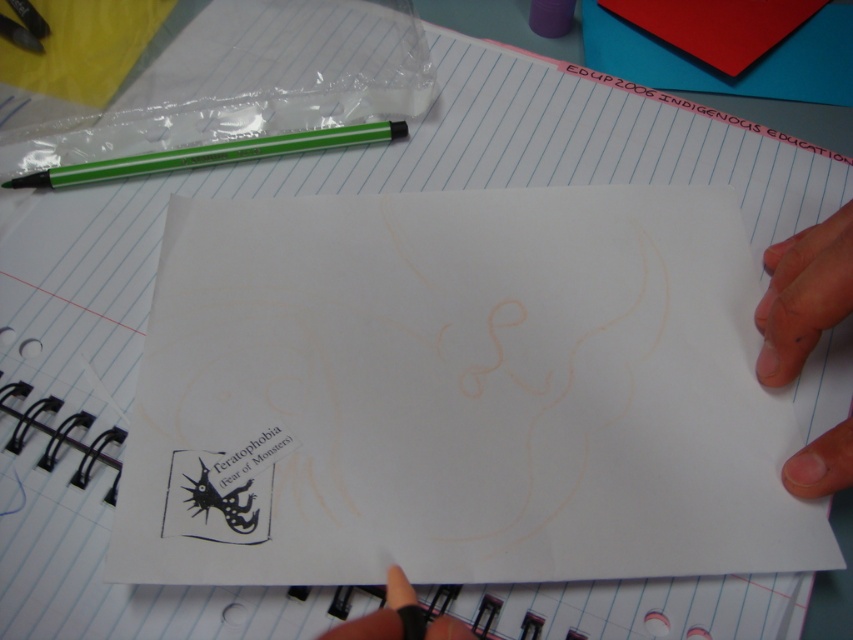
Who is more forward, (762, 301) or (392, 627)?

Point (392, 627) is in front.

Between point (799, 492) and point (401, 609), which one is positioned behind?

Point (799, 492)

This screenshot has width=853, height=640. In order to click on dry skin at lower right in this screenshot , I will do `click(804, 294)`.

Does green plastic pen at upper left have a lesser height compared to black matte finger at lower center?

No.

Between point (206, 163) and point (457, 627), which one is positioned in front?

Point (457, 627)

Who is more forward, (253, 150) or (398, 576)?

Point (398, 576) is in front.

You are a GUI agent. You are given a task and a screenshot of the screen. Output one action in this format:
    pyautogui.click(x=<x>, y=<y>)
    Task: Click on the green plastic pen at upper left
    
    Given the screenshot: What is the action you would take?
    pyautogui.click(x=212, y=154)

Who is positioned more to the right, white paper at center or dry skin at lower right?

Positioned to the right is dry skin at lower right.

Which is more to the left, white paper at center or dry skin at lower right?

Positioned to the left is white paper at center.

Describe the element at coordinates (457, 394) in the screenshot. I see `white paper at center` at that location.

Locate an element on the screen. white paper at center is located at coordinates (457, 394).